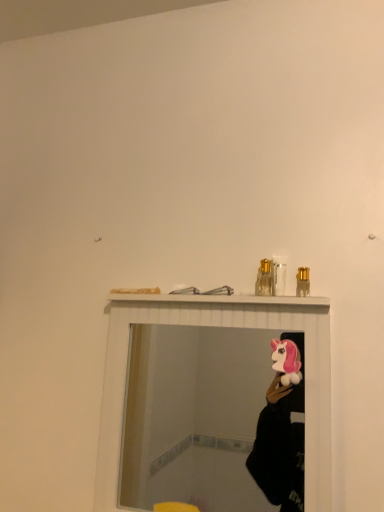
Measure the distance between white glossy mirror at upper center and camera.

white glossy mirror at upper center and camera are 5.83 feet apart from each other.

In order to face white glossy mirror at upper center, should I rotate leftwards or rightwards?

Turn right approximately 1.464 degrees to face it.

Describe the element at coordinates (210, 421) in the screenshot. The height and width of the screenshot is (512, 384). I see `white glossy mirror at upper center` at that location.

I want to click on white glossy mirror at upper center, so click(x=210, y=421).

Find the location of a particular element. white glossy mirror at upper center is located at coordinates (210, 421).